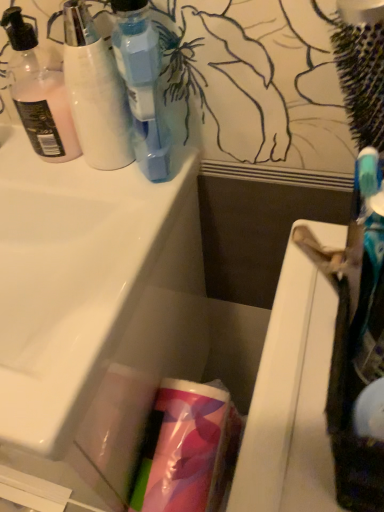
The height and width of the screenshot is (512, 384). What are the coordinates of `free space in front of transparent plastic bottle at upper left, which is the 3th bottle in left-to-right order` in the screenshot? It's located at (127, 233).